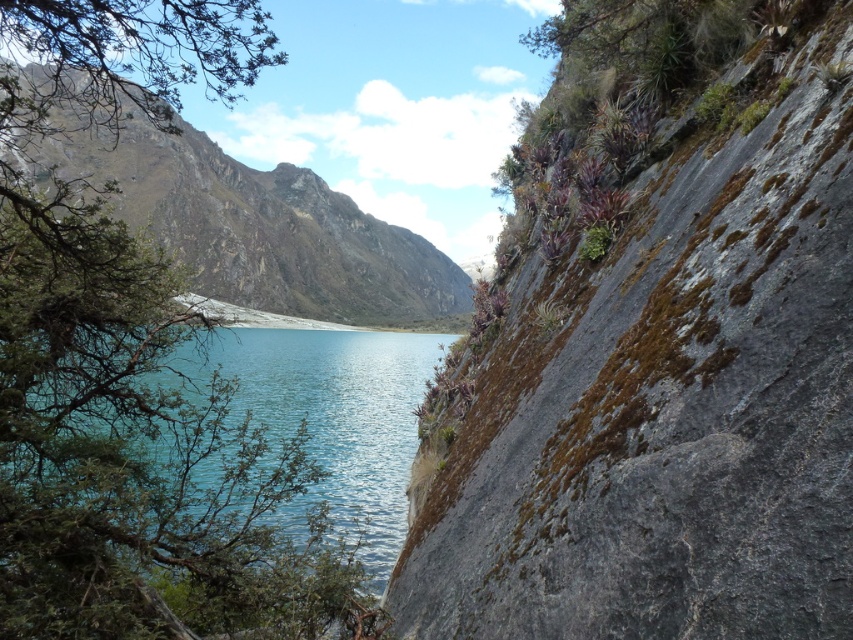
Looking at this image, who is lower down, green mossy rock at right or rugged stone mountain at center?

green mossy rock at right is lower down.

Which is more to the left, green mossy rock at right or rugged stone mountain at center?

rugged stone mountain at center is more to the left.

This screenshot has height=640, width=853. What do you see at coordinates (654, 344) in the screenshot?
I see `green mossy rock at right` at bounding box center [654, 344].

Identify the location of green mossy rock at right. (654, 344).

Does green mossy rock at right appear on the right side of teal glassy water at center?

Correct, you'll find green mossy rock at right to the right of teal glassy water at center.

Which is behind, point (796, 301) or point (169, 387)?

The point (169, 387) is more distant.

Locate an element on the screen. The height and width of the screenshot is (640, 853). green mossy rock at right is located at coordinates (654, 344).

Identify the location of rugged stone mountain at center. The width and height of the screenshot is (853, 640). (262, 228).

The width and height of the screenshot is (853, 640). In order to click on rugged stone mountain at center in this screenshot , I will do `click(262, 228)`.